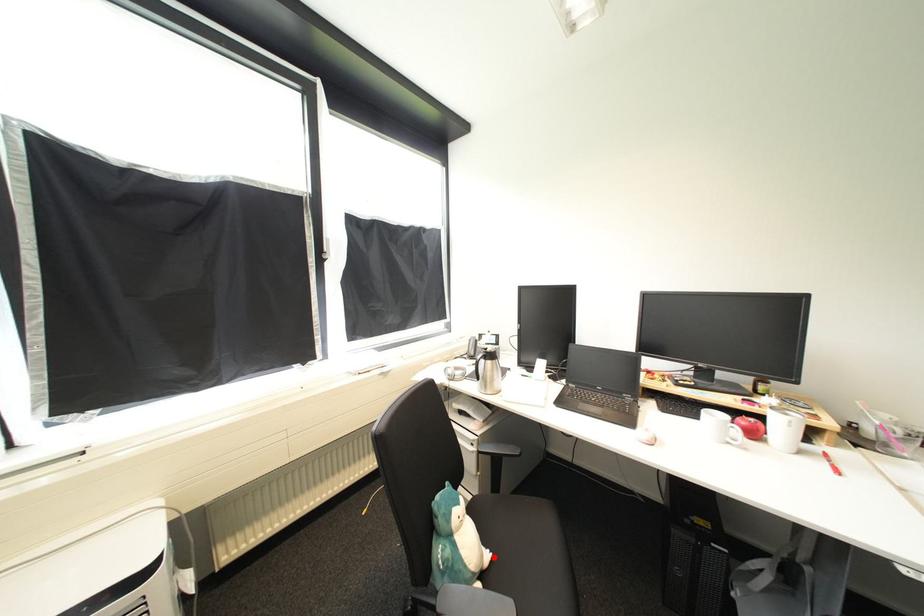
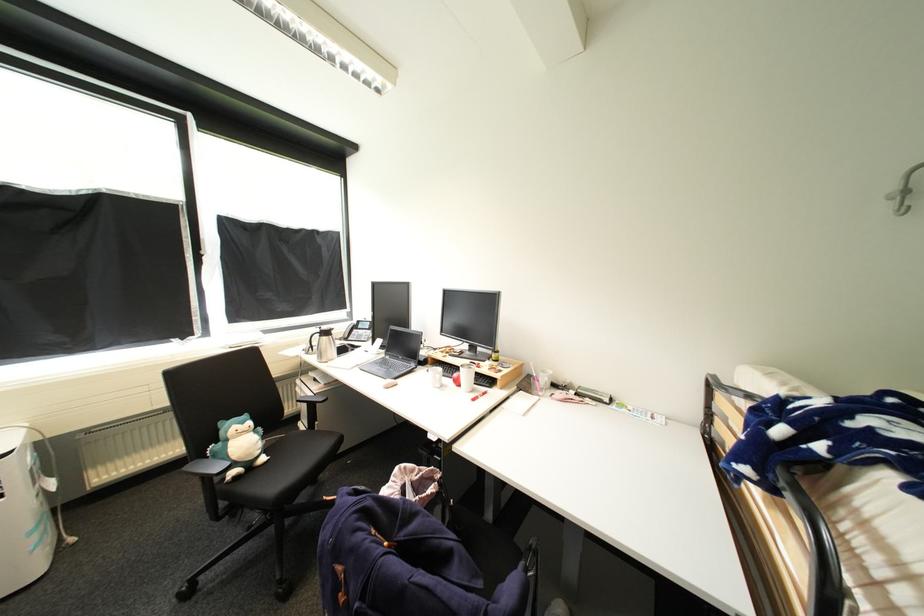
Question: I am providing you with two images of the same scene from different viewpoints. Given a red point in image1, look at the same physical point in image2. Is it:

Choices:
 (A) Closer to the viewpoint
 (B) Farther from the viewpoint

Answer: (A)